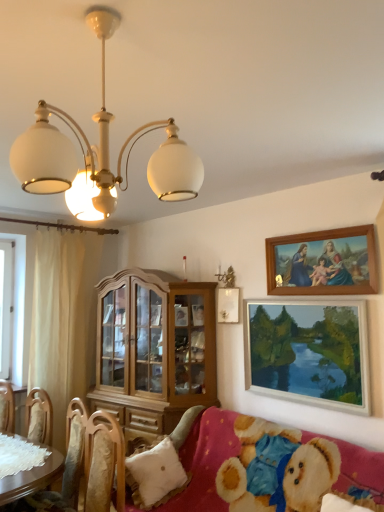
Where is `free location above wooden picture frame at lower right, marked as the second picture frame in a top-to-bottom arrangement (from a real-world perspective)`? The image size is (384, 512). free location above wooden picture frame at lower right, marked as the second picture frame in a top-to-bottom arrangement (from a real-world perspective) is located at coordinates (302, 295).